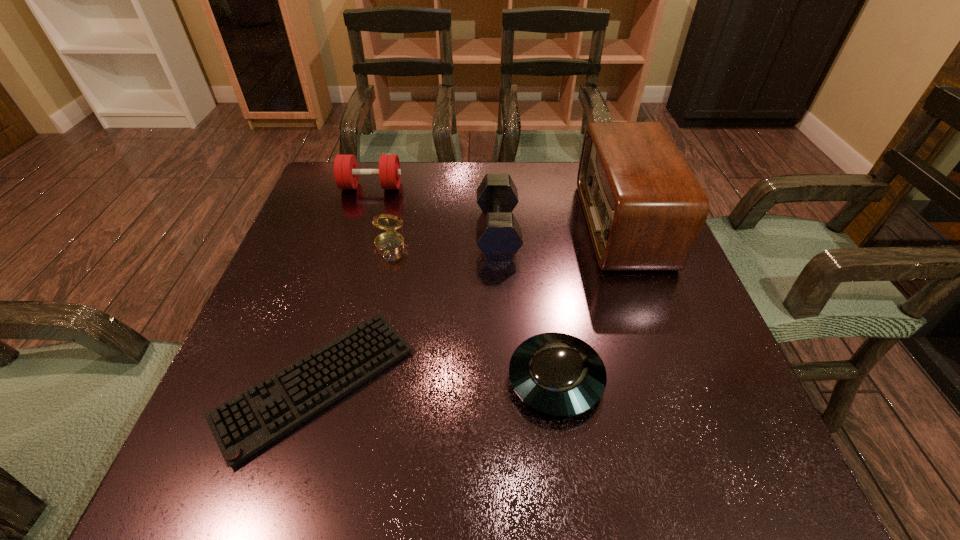
This screenshot has width=960, height=540. What are the coordinates of `free spot that satisfies the following two spatial constraints: 1. with the dial facing the compass; 2. on the left side of the saucer` in the screenshot? It's located at (361, 379).